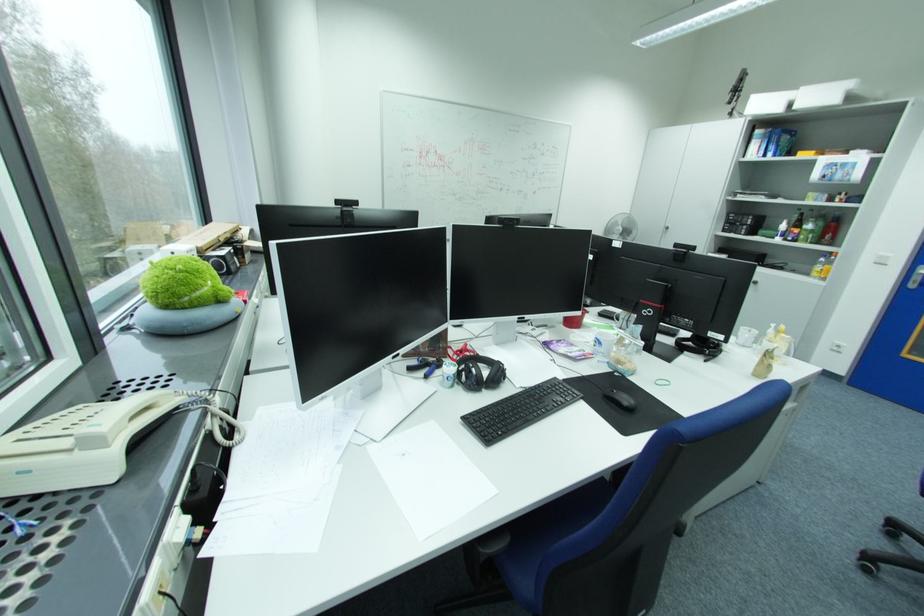
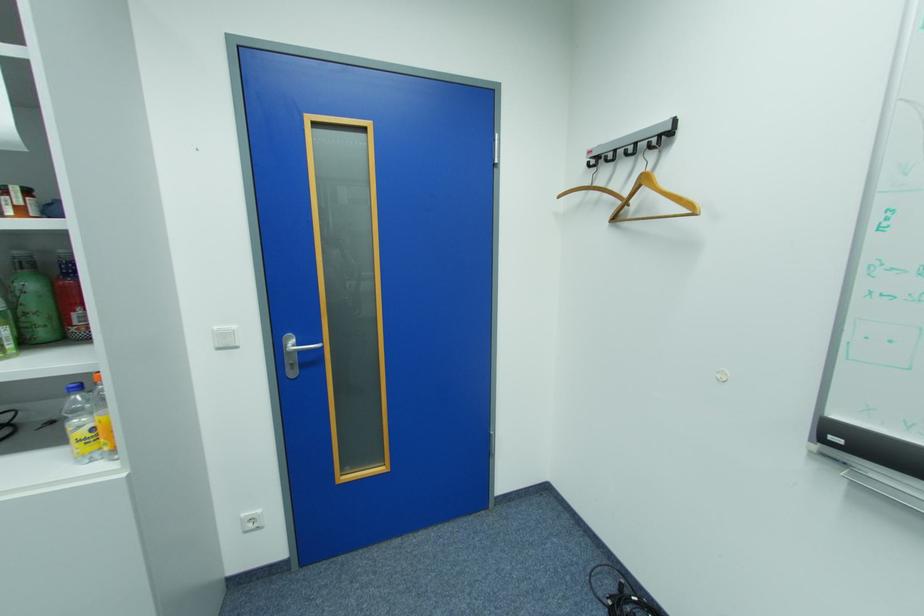
In the second image, find the point that corresponds to point 846,214 in the first image.

(69, 252)